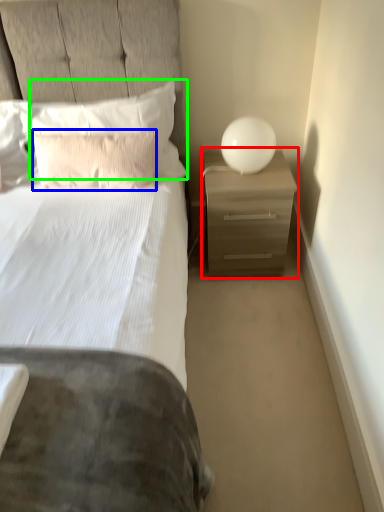
Question: Estimate the real-world distances between objects in this image. Which object is farther from nightstand (highlighted by a red box), pillow (highlighted by a blue box) or pillow (highlighted by a green box)?

Choices:
 (A) pillow
 (B) pillow

Answer: (A)